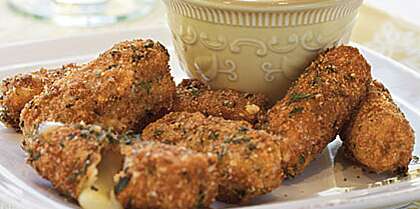
Identify the location of plate. The height and width of the screenshot is (209, 420). (51, 52).